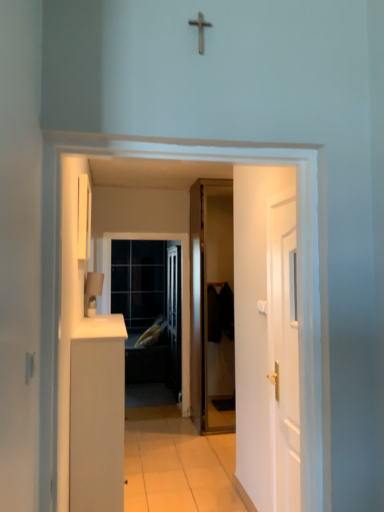
Question: Can we say metallic cross at upper center lies outside black matte door at center, the 1th door in the left-to-right sequence?

Choices:
 (A) no
 (B) yes

Answer: (B)

Question: Does metallic cross at upper center have a larger size compared to black matte door at center, acting as the second door starting from the front?

Choices:
 (A) yes
 (B) no

Answer: (B)

Question: Does metallic cross at upper center have a smaller size compared to black matte door at center, the 2th door from the right?

Choices:
 (A) yes
 (B) no

Answer: (A)

Question: From a real-world perspective, is metallic cross at upper center beneath black matte door at center, acting as the second door starting from the front?

Choices:
 (A) yes
 (B) no

Answer: (B)

Question: From the image's perspective, is metallic cross at upper center under black matte door at center, positioned as the 1th door in back-to-front order?

Choices:
 (A) yes
 (B) no

Answer: (B)

Question: Considering the relative sizes of metallic cross at upper center and black matte door at center, the 2th door from the right, in the image provided, is metallic cross at upper center shorter than black matte door at center, the 2th door from the right,?

Choices:
 (A) yes
 (B) no

Answer: (A)

Question: Is metallic cross at upper center positioned beyond the bounds of matte glass screen door at center?

Choices:
 (A) yes
 (B) no

Answer: (A)

Question: Is matte glass screen door at center surrounded by metallic cross at upper center?

Choices:
 (A) no
 (B) yes

Answer: (A)

Question: Is the depth of metallic cross at upper center less than that of matte glass screen door at center?

Choices:
 (A) no
 (B) yes

Answer: (B)

Question: Is metallic cross at upper center in contact with matte glass screen door at center?

Choices:
 (A) no
 (B) yes

Answer: (A)

Question: Considering the relative sizes of metallic cross at upper center and matte glass screen door at center in the image provided, is metallic cross at upper center taller than matte glass screen door at center?

Choices:
 (A) yes
 (B) no

Answer: (B)

Question: Considering the relative sizes of metallic cross at upper center and matte glass screen door at center in the image provided, is metallic cross at upper center shorter than matte glass screen door at center?

Choices:
 (A) yes
 (B) no

Answer: (A)

Question: Does transparent glass door at center appear on the right side of black matte door at center, acting as the second door starting from the front?

Choices:
 (A) no
 (B) yes

Answer: (A)